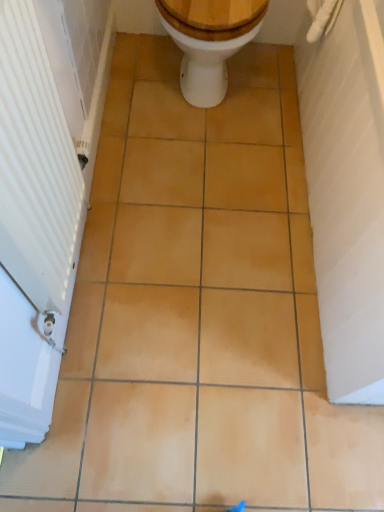
Question: From the image's perspective, relative to white glossy toilet at center, is white ribbed radiator at left above or below?

Choices:
 (A) below
 (B) above

Answer: (A)

Question: Would you say white ribbed radiator at left is to the left or to the right of white glossy toilet at center in the picture?

Choices:
 (A) left
 (B) right

Answer: (A)

Question: From a real-world perspective, is white ribbed radiator at left positioned above or below white glossy toilet at center?

Choices:
 (A) below
 (B) above

Answer: (B)

Question: Looking at the image, does white glossy toilet at center seem bigger or smaller compared to white ribbed radiator at left?

Choices:
 (A) big
 (B) small

Answer: (A)

Question: Relative to white ribbed radiator at left, is white glossy toilet at center in front or behind?

Choices:
 (A) behind
 (B) front

Answer: (A)

Question: From the image's perspective, is white glossy toilet at center positioned above or below white ribbed radiator at left?

Choices:
 (A) below
 (B) above

Answer: (B)

Question: From a real-world perspective, is white glossy toilet at center positioned above or below white ribbed radiator at left?

Choices:
 (A) above
 (B) below

Answer: (B)